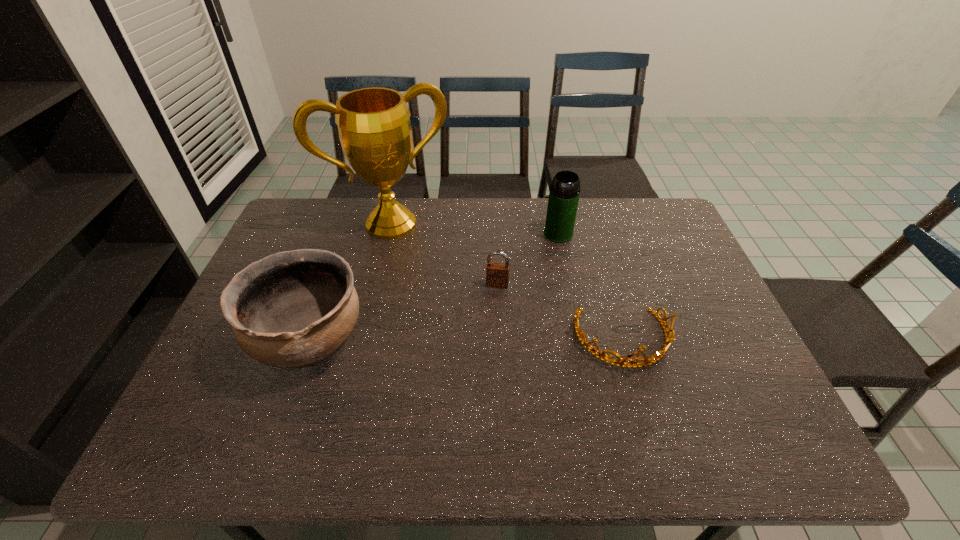
Locate an element on the screen. The height and width of the screenshot is (540, 960). empty location between the fourth shortest object and the pottery is located at coordinates (434, 287).

Identify the location of vacant area that lies between the padlock and the third shortest object. (403, 312).

The image size is (960, 540). I want to click on vacant region between the third object from left to right and the thermos bottle, so click(x=528, y=259).

The width and height of the screenshot is (960, 540). In order to click on free point between the thermos bottle and the award in this screenshot , I will do `click(475, 229)`.

This screenshot has width=960, height=540. Identify the location of vacant space that is in between the pottery and the fourth tallest object. (403, 312).

The image size is (960, 540). Identify the location of empty location between the tallest object and the second shortest object. (444, 254).

The height and width of the screenshot is (540, 960). I want to click on vacant space in between the tiara and the third tallest object, so click(467, 340).

Where is `free area in between the pottery and the shortest object`? free area in between the pottery and the shortest object is located at coordinates (467, 340).

In order to click on object that stands as the second closest to the pottery in this screenshot , I will do `click(497, 274)`.

Choose which object is the second nearest neighbor to the tiara. Please provide its 2D coordinates. Your answer should be formatted as a tuple, i.e. [(x, y)], where the tuple contains the x and y coordinates of a point satisfying the conditions above.

[(564, 193)]